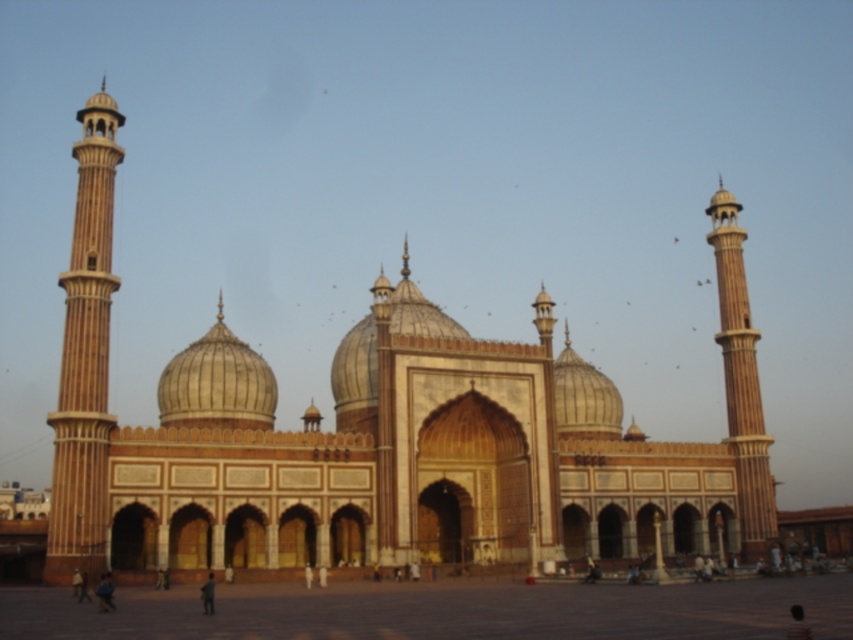
Between point (86, 246) and point (730, 198), which one is positioned behind?

The point (730, 198) is more distant.

Locate an element on the screen. Image resolution: width=853 pixels, height=640 pixels. smooth beige tower at left is located at coordinates (85, 356).

Is point (76, 428) positioned before point (755, 488)?

Yes, it is.

Find the location of `smooth beige tower at left`. smooth beige tower at left is located at coordinates (85, 356).

Consider the image. Does brown stone mosque at center appear on the left side of smooth beige tower at right?

Indeed, brown stone mosque at center is positioned on the left side of smooth beige tower at right.

Does brown stone mosque at center have a greater width compared to smooth beige tower at right?

Correct, the width of brown stone mosque at center exceeds that of smooth beige tower at right.

Find the location of `brown stone mosque at center`. brown stone mosque at center is located at coordinates (393, 440).

The image size is (853, 640). I want to click on brown stone mosque at center, so click(393, 440).

Is point (403, 522) positioned before point (267, 416)?

That is True.

Can you confirm if brown stone mosque at center is bigger than golden textured dome at center?

Yes, brown stone mosque at center is bigger than golden textured dome at center.

Is point (94, 406) closer to camera compared to point (202, 355)?

Yes, point (94, 406) is in front of point (202, 355).

Where is `brown stone mosque at center`? brown stone mosque at center is located at coordinates (393, 440).